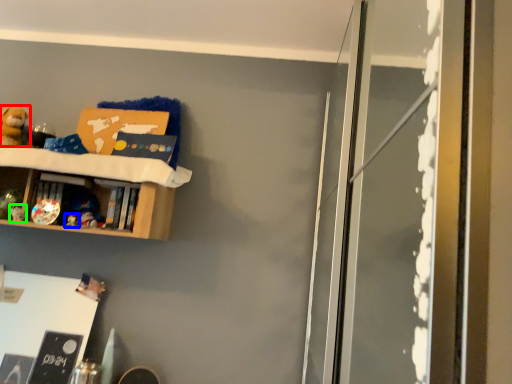
Question: Based on their relative distances, which object is nearer to toy (highlighted by a red box)? Choose from toy (highlighted by a blue box) and toy (highlighted by a green box).

Choices:
 (A) toy
 (B) toy

Answer: (B)